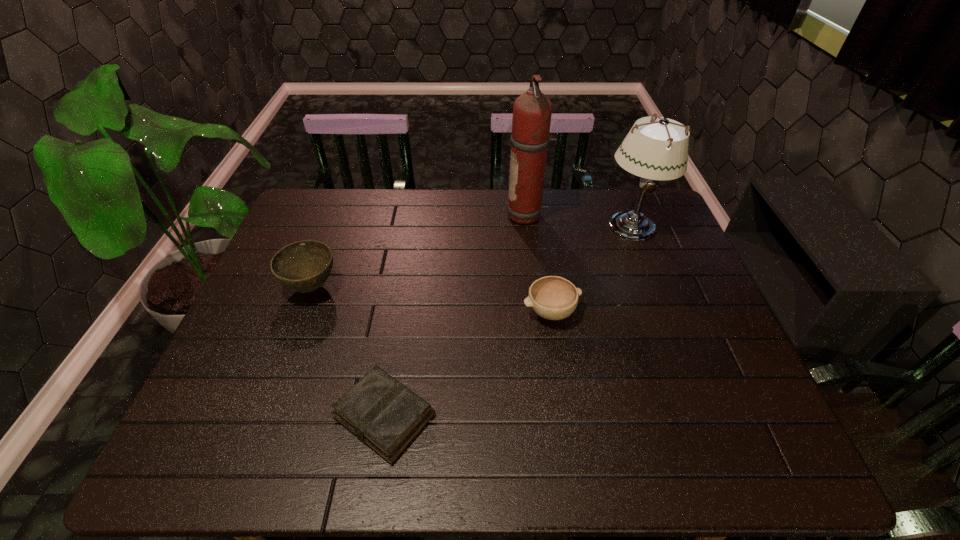
Image resolution: width=960 pixels, height=540 pixels. What are the coordinates of `free location that satisfies the following two spatial constraints: 1. on the back side of the nearest object; 2. on the right side of the shorter bowl` in the screenshot? It's located at (401, 312).

Identify the location of vacant point that satisfies the following two spatial constraints: 1. on the side of the shorter bowl with the label and nozzle; 2. on the left side of the tallest object. (539, 312).